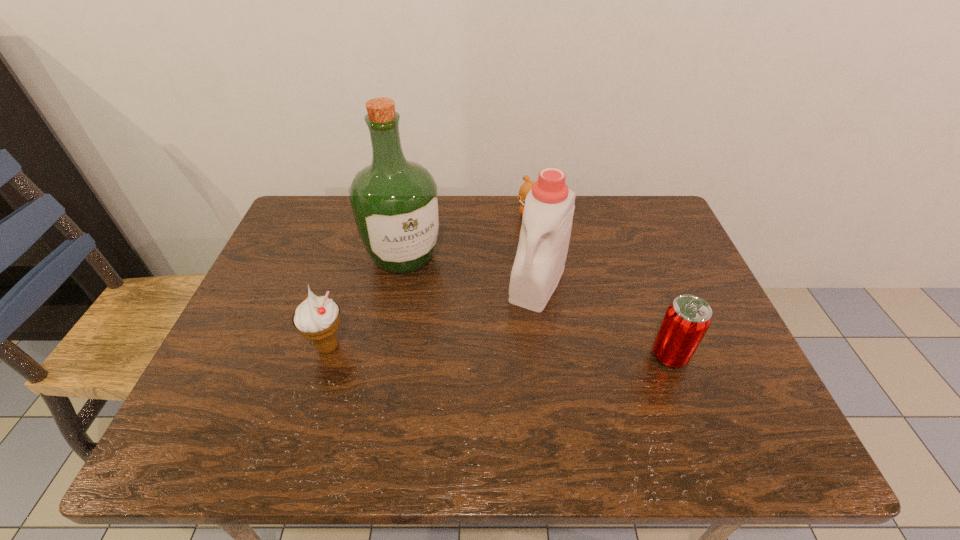
Locate an element on the screen. The width and height of the screenshot is (960, 540). icecream is located at coordinates (317, 318).

Identify the location of soda can. This screenshot has height=540, width=960. pos(687,319).

Locate an element on the screen. Image resolution: width=960 pixels, height=540 pixels. liquor is located at coordinates (395, 202).

Locate an element on the screen. the farthest object is located at coordinates (527, 186).

I want to click on the shortest object, so click(527, 186).

You are a GUI agent. You are given a task and a screenshot of the screen. Output one action in this format:
    pyautogui.click(x=<x>, y=<y>)
    Task: Click on the second tallest object
    The height and width of the screenshot is (540, 960).
    Given the screenshot: What is the action you would take?
    pyautogui.click(x=549, y=206)

This screenshot has height=540, width=960. In order to click on vacant space located on the right of the icecream in this screenshot , I will do 523,347.

Locate an element on the screen. The image size is (960, 540). free space located on the left of the rightmost object is located at coordinates (558, 355).

You are a GUI agent. You are given a task and a screenshot of the screen. Output one action in this format:
    pyautogui.click(x=<x>, y=<y>)
    Task: Click on the vacant space situated 0.080m on the front-facing side of the tallest object
    The width and height of the screenshot is (960, 540).
    Given the screenshot: What is the action you would take?
    pyautogui.click(x=431, y=301)

The image size is (960, 540). Identify the location of free region located 0.290m on the front-facing side of the tallest object. (468, 361).